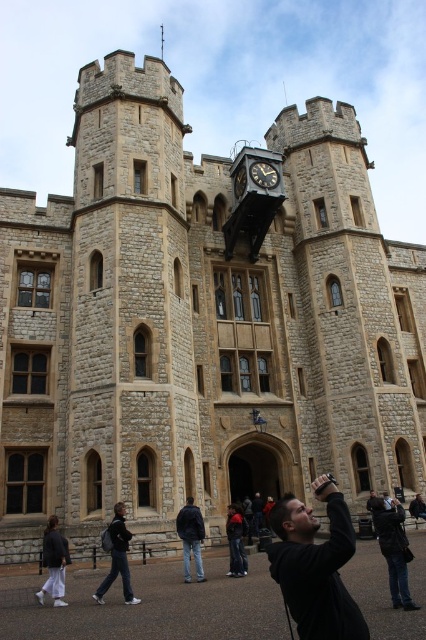
Is black metal clock at upper center to the left of dark brown wooden clock at center from the viewer's perspective?

In fact, black metal clock at upper center is to the right of dark brown wooden clock at center.

Between black metal clock at upper center and dark brown wooden clock at center, which one appears on the right side from the viewer's perspective?

black metal clock at upper center

Is point (256, 176) positioned before point (236, 179)?

Yes, it is.

Locate an element on the screen. This screenshot has height=640, width=426. black metal clock at upper center is located at coordinates (264, 173).

Can you confirm if white cotton pants at lower left is positioned above dark brown wooden clock at center?

No, white cotton pants at lower left is not above dark brown wooden clock at center.

Which is behind, point (62, 573) or point (241, 173)?

Point (241, 173)

Which is in front, point (65, 557) or point (239, 188)?

Positioned in front is point (65, 557).

Find the location of a particular element. This screenshot has width=426, height=640. white cotton pants at lower left is located at coordinates (54, 563).

Is dark gray jacket at lower right closer to camera compared to black metal clock at upper center?

Yes, it is in front of black metal clock at upper center.

Which is in front, point (382, 497) or point (265, 184)?

Point (382, 497)

Is point (371, 509) closer to viewer compared to point (250, 170)?

Yes, point (371, 509) is in front of point (250, 170).

The height and width of the screenshot is (640, 426). I want to click on dark gray jacket at lower right, so click(394, 548).